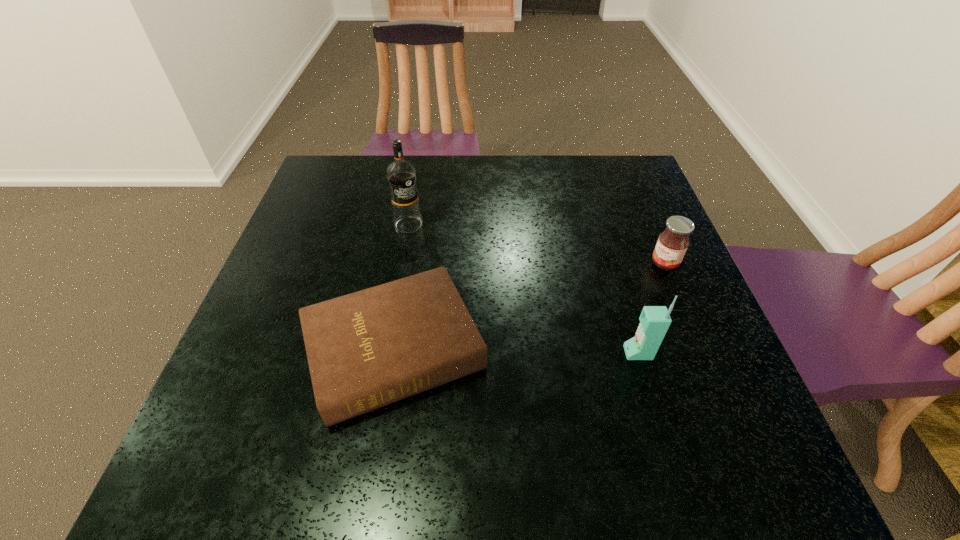
Where is `jam at the right edge`? The image size is (960, 540). jam at the right edge is located at coordinates (672, 244).

What are the coordinates of `object that is at the near left corner` in the screenshot? It's located at (365, 350).

In the image, there is a desktop. Where is `vacant space at the far edge`? This screenshot has height=540, width=960. vacant space at the far edge is located at coordinates (566, 191).

Where is `free space at the near edge`? This screenshot has height=540, width=960. free space at the near edge is located at coordinates (363, 417).

This screenshot has height=540, width=960. I want to click on vacant space at the left edge of the desktop, so click(310, 225).

This screenshot has width=960, height=540. I want to click on free space at the right edge of the desktop, so 646,232.

At what (x,y) coordinates should I click in order to perform the action: click on vacant space at the far left corner of the desktop. Please return your answer as a coordinate pair (x, y). The image size is (960, 540). Looking at the image, I should click on (367, 157).

Find the location of a particular element. The image size is (960, 540). free space at the near left corner is located at coordinates (263, 422).

In the image, there is a desktop. Identify the location of vacant space at the far right corner. (629, 184).

Identify the location of vacant space that is in between the Bible and the third nearest object. (530, 307).